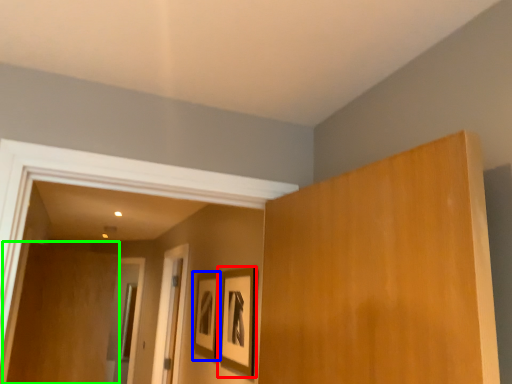
Question: Estimate the real-world distances between objects in this image. Which object is closer to picture frame (highlighted by a red box), picture frame (highlighted by a blue box) or plywood (highlighted by a green box)?

Choices:
 (A) picture frame
 (B) plywood

Answer: (A)